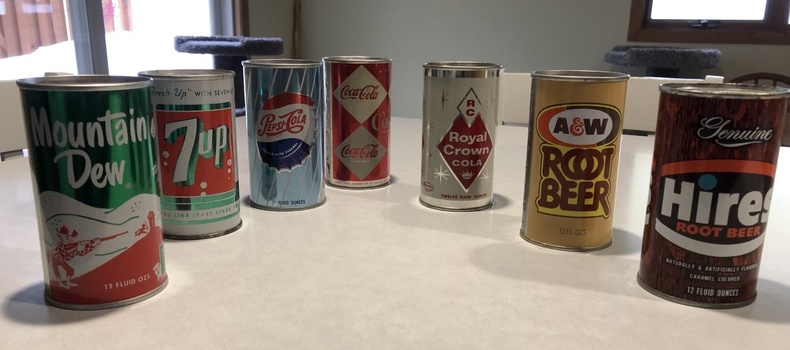
At what (x,y) coordinates should I click in order to perform the action: click on left pane window glass. Please return your answer as a coordinate pair (x, y). Looking at the image, I should click on (40, 47).